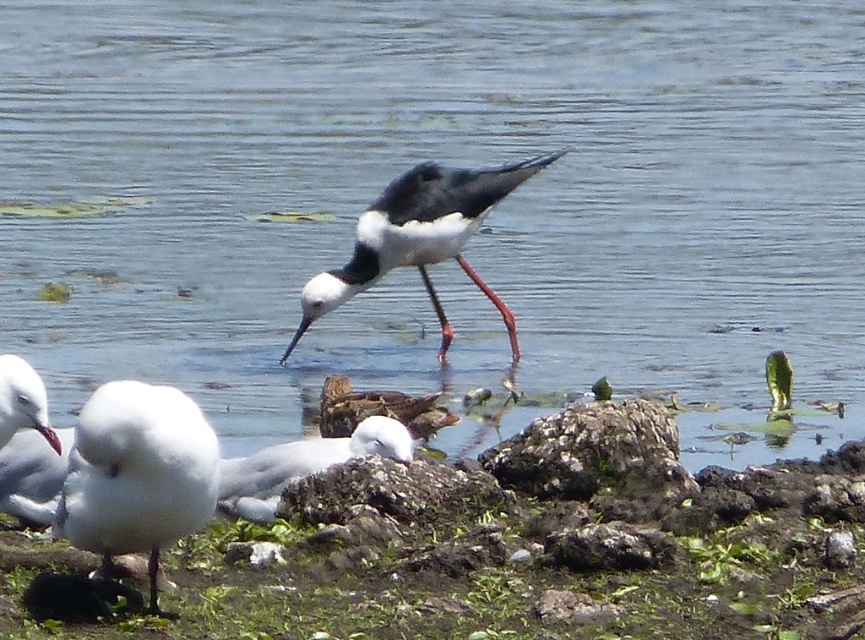
You are a birdwatcher observing the scene. You notice a white fluffy feather at lower left and a smooth pink leg at center. Which object is taller in the image?

The white fluffy feather at lower left is much taller than the smooth pink leg at center according to the description.

You are an ornithologist observing the scene. You notice a white fluffy feather at lower left and a smooth pink leg at center. Which object has a greater width?

The white fluffy feather at lower left has a greater width than the smooth pink leg at center.